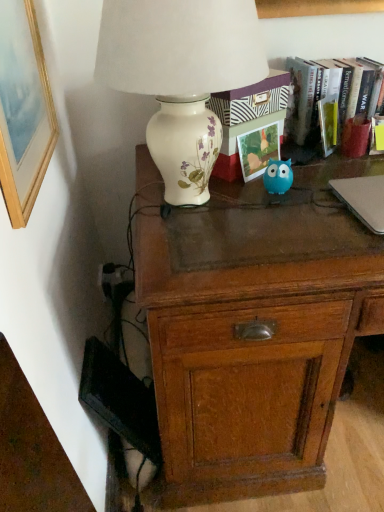
The height and width of the screenshot is (512, 384). What are the coordinates of `blank space to the left of blue rubber toy at center` in the screenshot? It's located at (228, 198).